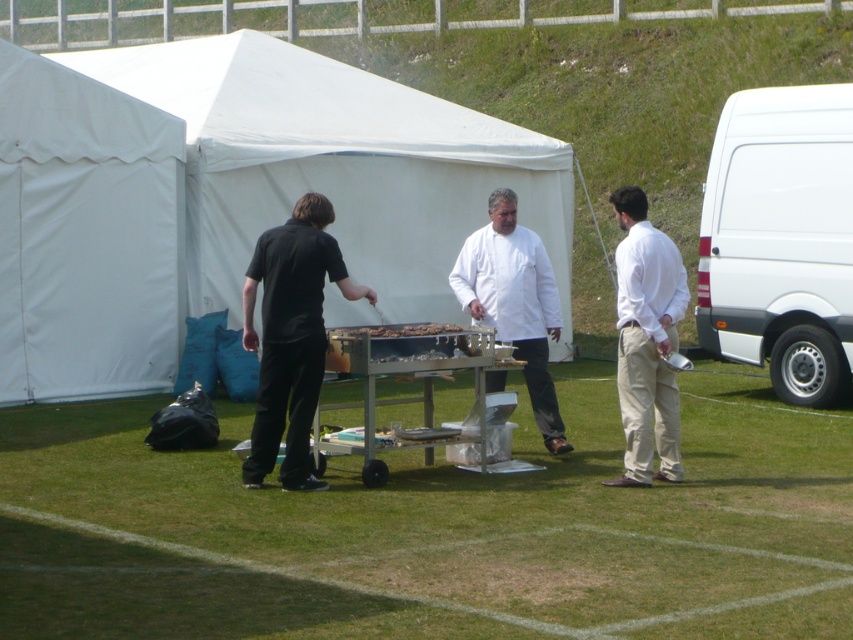
You are standing at the center of the grassy field and want to walk to the white matte van at right. Which direction should you head?

The white matte van at right is located at point 0.375 on the x axis and 0.917 on the y axis. Since you are at the center, you should head towards the right and slightly forward direction to reach the van.

You are planning to set up a food stall at the event. You have a white fabric tent at center and a white matte van at right. Which one is located to the left side of the other?

The white fabric tent at center is positioned on the left side of the white matte van at right.

You are a food safety inspector visiting a food truck. You see the white cotton shirt at right and the smooth wooden cutting board at center. The food truck requires that all staff must be at least 2 meters away from any food preparation surfaces to prevent contamination. Are both individuals compliant with this rule?

The distance between the white cotton shirt at right and the smooth wooden cutting board at center is 1.74 meters, which is less than the required 2 meters. Therefore, they are not compliant with the food safety rule.